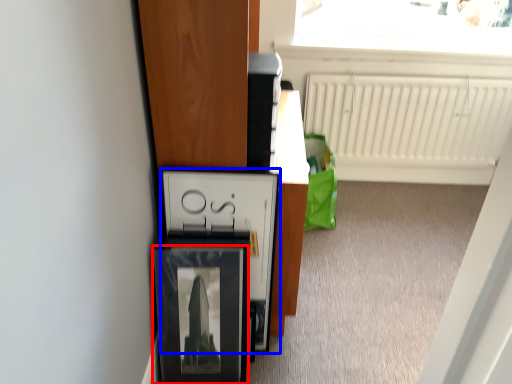
Question: Which of the following is the closest to the observer, picture frame (highlighted by a red box) or cabinetry (highlighted by a blue box)?

Choices:
 (A) picture frame
 (B) cabinetry

Answer: (A)